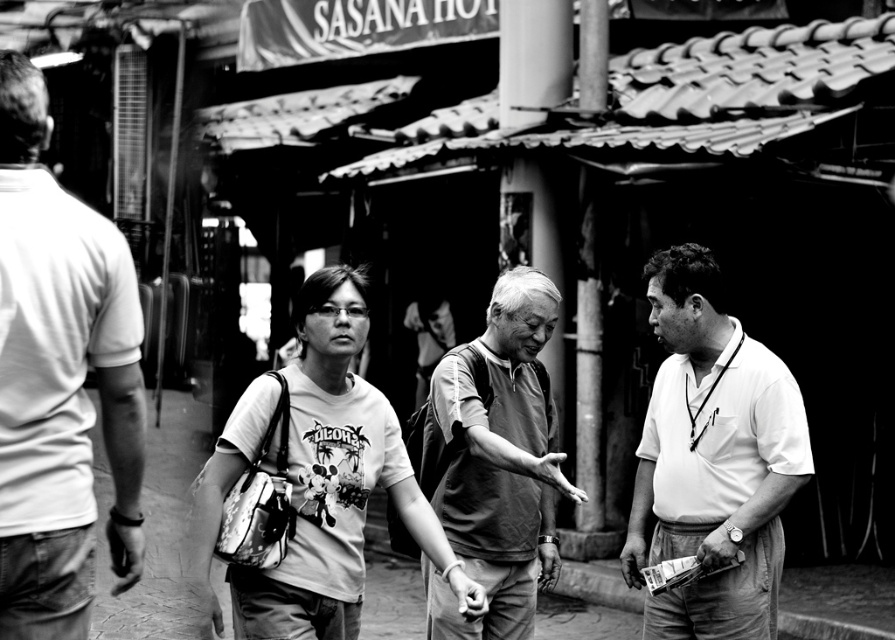
Question: Which object is closer to the camera taking this photo?

Choices:
 (A) smooth concrete pavement at center
 (B) textured gray shirt at center
 (C) white cotton shirt at right

Answer: (B)

Question: Which point is farther to the camera?

Choices:
 (A) (314, 500)
 (B) (474, 516)
 (C) (539, 618)

Answer: (C)

Question: Does white cotton shirt at left have a lesser width compared to textured gray shirt at center?

Choices:
 (A) yes
 (B) no

Answer: (A)

Question: Can you confirm if white cotton shirt at right is positioned to the right of white cotton t-shirt at center?

Choices:
 (A) no
 (B) yes

Answer: (B)

Question: Among these objects, which one is farthest from the camera?

Choices:
 (A) white cotton shirt at right
 (B) textured gray shirt at center

Answer: (A)

Question: Can you confirm if white cotton shirt at right is positioned to the right of textured gray shirt at center?

Choices:
 (A) yes
 (B) no

Answer: (A)